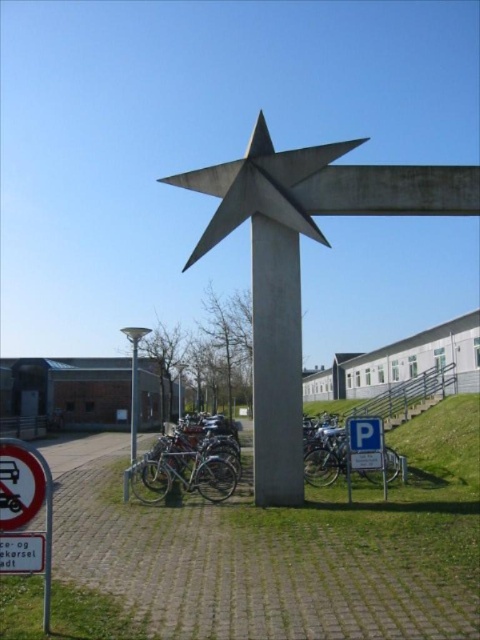
You are a pedestrian trying to locate the parking sign in the scene. From your vantage point, which object is closer to you between the silver metallic bicycle at center and the white plastic parking sign at lower right?

The silver metallic bicycle at center is closer to you since the white plastic parking sign at lower right is positioned behind it.